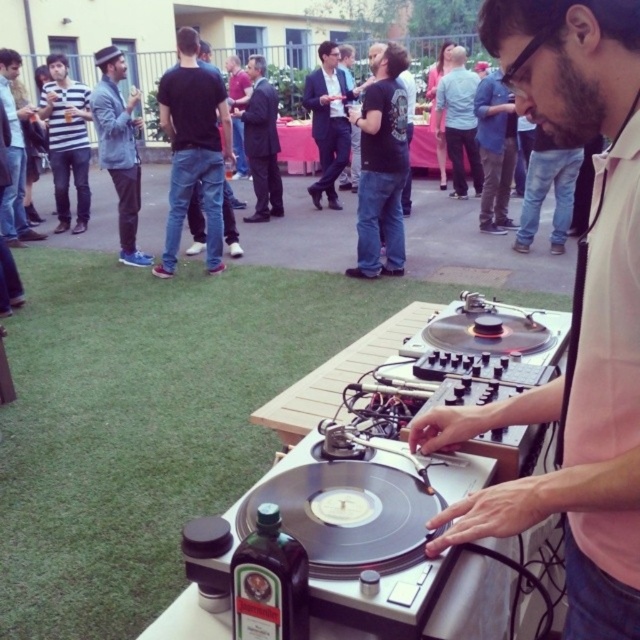
You are at the DJ setup and want to place a new drink on the white plastic table at center. Can you reach it without moving from your current position?

The white plastic table at center is located at point (342, 378), so yes, you can reach it from your current position at the DJ setup.

You are a photographer at the party and need to capture a photo of both the pink shirt at center and the dark suit jacket at center. Since you want to ensure both are fully visible in the frame, which object should you focus on first to adjust your camera angle?

The pink shirt at center is shorter than the dark suit jacket at center. To ensure both are fully visible, focus on the pink shirt at center first to adjust the camera angle so it captures the shorter object before framing the taller one.